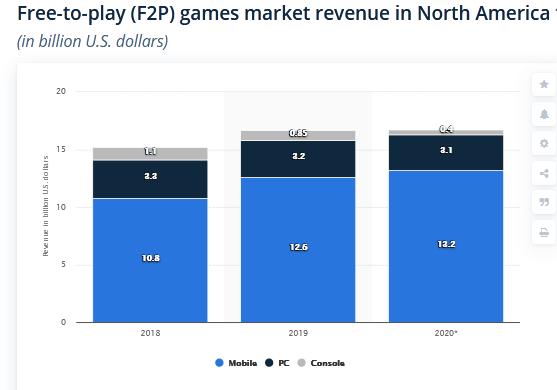
Locate an element on the screen. The image size is (557, 390). pc is located at coordinates (268, 364).